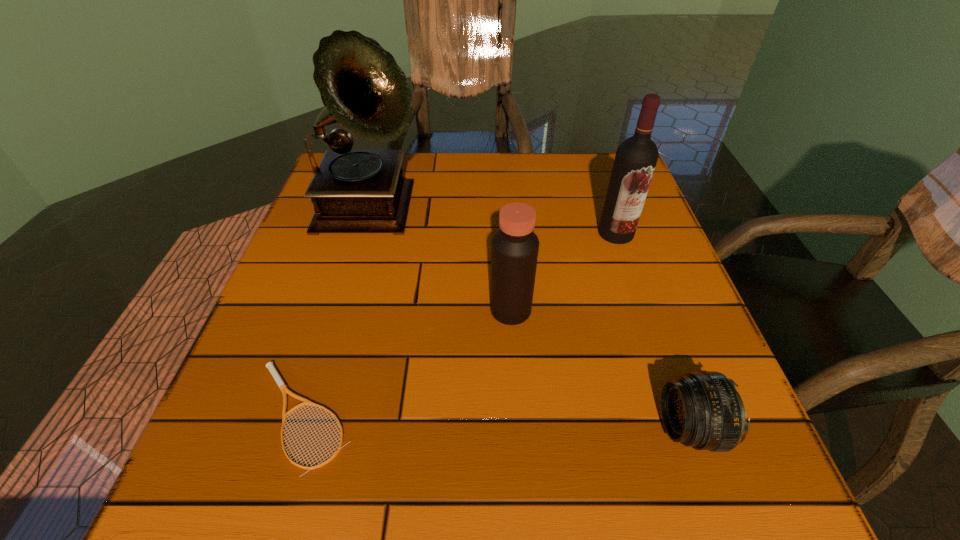
You are a GUI agent. You are given a task and a screenshot of the screen. Output one action in this format:
    pyautogui.click(x=<x>, y=<y>)
    Task: Click on the object that is at the far left corner
    
    Given the screenshot: What is the action you would take?
    pyautogui.click(x=363, y=89)

Find the location of a particular element. object positioned at the near left corner is located at coordinates (270, 365).

At what (x,y) coordinates should I click in order to perform the action: click on object that is at the near right corner. Please return your answer as a coordinate pair (x, y). Looking at the image, I should click on (703, 410).

This screenshot has height=540, width=960. In the image, there is a desktop. What are the coordinates of `vacant space at the far edge` in the screenshot? It's located at (420, 178).

Locate an element on the screen. This screenshot has height=540, width=960. vacant space at the near edge of the desktop is located at coordinates (331, 494).

You are a GUI agent. You are given a task and a screenshot of the screen. Output one action in this format:
    pyautogui.click(x=<x>, y=<y>)
    Task: Click on the vacant space at the left edge of the desktop
    
    Given the screenshot: What is the action you would take?
    pyautogui.click(x=267, y=376)

Identify the location of free space at the right edge of the desktop. This screenshot has width=960, height=540. (611, 276).

The image size is (960, 540). Identify the location of vacant space at the far right corner of the desktop. click(586, 185).

At what (x,y) coordinates should I click in order to perform the action: click on vacant space at the near right corner. Please return your answer as a coordinate pair (x, y). Image resolution: width=960 pixels, height=540 pixels. Looking at the image, I should click on (739, 497).

Where is `free area in between the telephoto lens and the tallest object`? Image resolution: width=960 pixels, height=540 pixels. free area in between the telephoto lens and the tallest object is located at coordinates tap(531, 320).